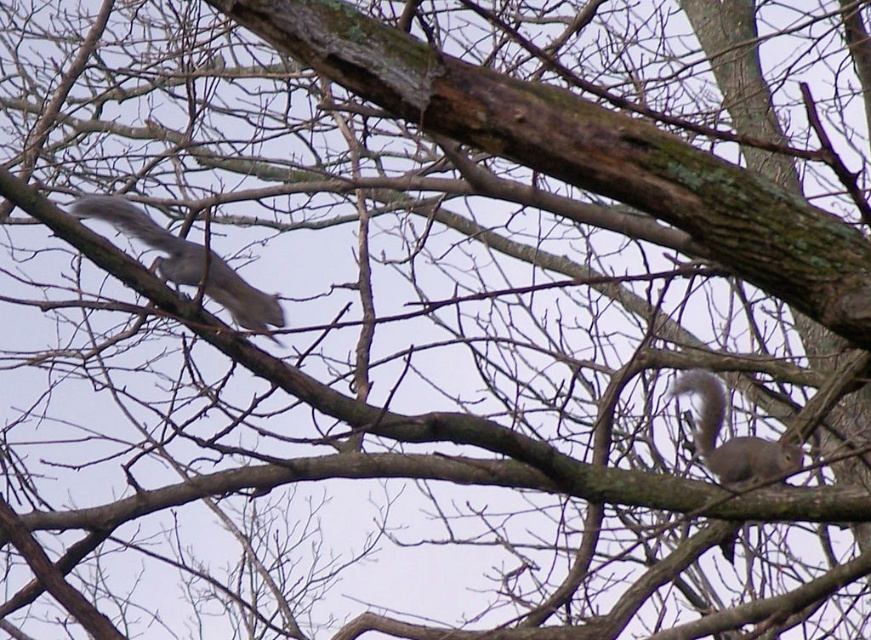
You are observing two points in the image of the squirrels in the tree. Which point, point (497, 122) or point (746, 438), is nearer to you?

Point (497, 122) is closer to the viewer than point (746, 438).